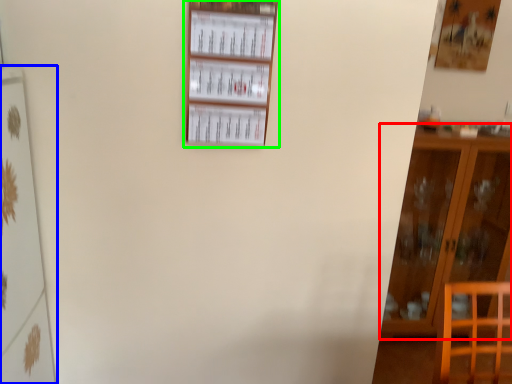
Question: Which is nearer to the furniture (highlighted by a red box)? shelf (highlighted by a blue box) or shelf (highlighted by a green box).

Choices:
 (A) shelf
 (B) shelf

Answer: (B)